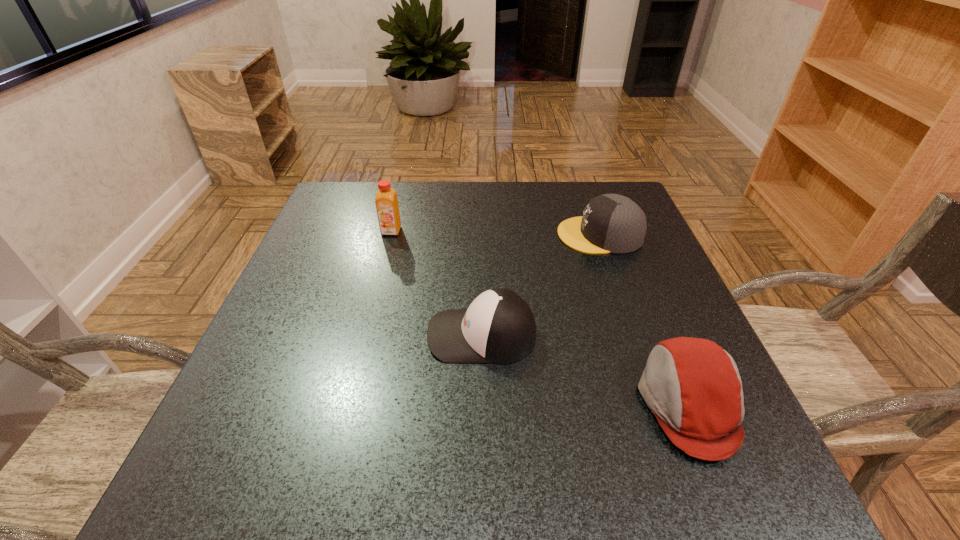
Locate an element on the screen. This screenshot has height=540, width=960. the leftmost object is located at coordinates (386, 201).

I want to click on the tallest object, so click(x=386, y=201).

Locate an element on the screen. Image resolution: width=960 pixels, height=540 pixels. the leftmost cap is located at coordinates coord(498,327).

Find the location of a particular element. This screenshot has width=960, height=540. the farthest cap is located at coordinates (611, 223).

Locate an element on the screen. The height and width of the screenshot is (540, 960). vacant space situated 0.160m on the front and back of the tallest object is located at coordinates (378, 281).

You are a GUI agent. You are given a task and a screenshot of the screen. Output one action in this format:
    pyautogui.click(x=<x>, y=<y>)
    Task: Click on the free space located on the front panel of the leftmost cap
    
    Given the screenshot: What is the action you would take?
    pyautogui.click(x=330, y=335)

Where is `free location located 0.110m on the front panel of the leftmost cap`? free location located 0.110m on the front panel of the leftmost cap is located at coordinates (369, 335).

Image resolution: width=960 pixels, height=540 pixels. In order to click on blank space located on the front panel of the leftmost cap in this screenshot , I will do `click(287, 335)`.

I want to click on vacant space located 0.100m on the front-facing side of the farthest cap, so click(516, 235).

Locate an element on the screen. The image size is (960, 540). free location located 0.360m on the front-facing side of the farthest cap is located at coordinates (407, 235).